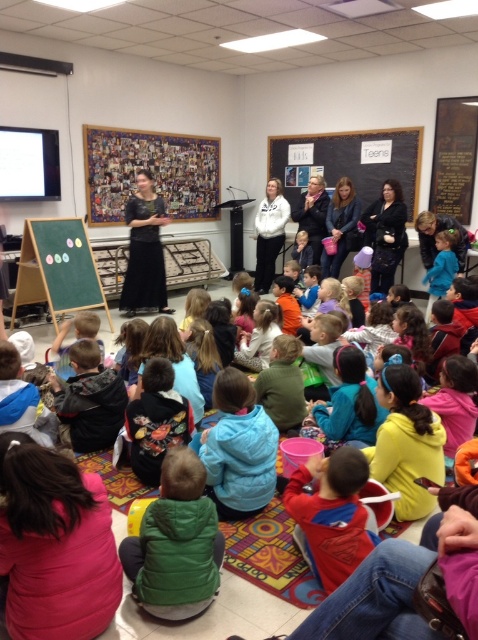
Question: Which of the following is the closest to the observer?

Choices:
 (A) (149, 198)
 (B) (170, 515)
 (C) (306, 528)

Answer: (B)

Question: Does blue fleece jacket at lower center have a greater width compared to red fleece jacket at lower center?

Choices:
 (A) yes
 (B) no

Answer: (A)

Question: Which object is the farthest from the black matte dress at center?

Choices:
 (A) black chalkboard at upper center
 (B) blue fleece jacket at lower center

Answer: (B)

Question: Does blue fleece jacket at lower center have a larger size compared to red fleece jacket at lower center?

Choices:
 (A) no
 (B) yes

Answer: (B)

Question: Based on their relative distances, which object is farther from the green fuzzy vest at lower center?

Choices:
 (A) blue fleece jacket at lower center
 (B) black chalkboard at upper center

Answer: (B)

Question: Is green fuzzy vest at lower center further to camera compared to blue fleece jacket at lower center?

Choices:
 (A) yes
 (B) no

Answer: (B)